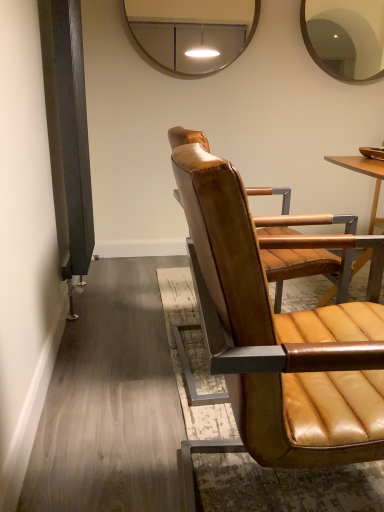
Question: Which direction should I rotate to look at metallic silver mirror at upper center, which is the 1th mirror from left to right, — up or down?

Choices:
 (A) down
 (B) up

Answer: (B)

Question: Does matte brown mirror at upper right, the second mirror viewed from the left, have a greater width compared to metallic silver mirror at upper center, which is the 1th mirror from left to right?

Choices:
 (A) no
 (B) yes

Answer: (B)

Question: Considering the relative sizes of matte brown mirror at upper right, marked as the first mirror in a right-to-left arrangement, and metallic silver mirror at upper center, which is the 1th mirror from left to right, in the image provided, is matte brown mirror at upper right, marked as the first mirror in a right-to-left arrangement, shorter than metallic silver mirror at upper center, which is the 1th mirror from left to right,?

Choices:
 (A) no
 (B) yes

Answer: (A)

Question: Is matte brown mirror at upper right, the second mirror viewed from the left, smaller than metallic silver mirror at upper center, arranged as the second mirror when viewed from the right?

Choices:
 (A) no
 (B) yes

Answer: (B)

Question: Is matte brown mirror at upper right, the second mirror viewed from the left, facing away from metallic silver mirror at upper center, which is the 1th mirror from left to right?

Choices:
 (A) yes
 (B) no

Answer: (B)

Question: From the image's perspective, does matte brown mirror at upper right, the second mirror viewed from the left, appear higher than metallic silver mirror at upper center, which is the 1th mirror from left to right?

Choices:
 (A) yes
 (B) no

Answer: (A)

Question: From a real-world perspective, is matte brown mirror at upper right, marked as the first mirror in a right-to-left arrangement, positioned over metallic silver mirror at upper center, arranged as the second mirror when viewed from the right, based on gravity?

Choices:
 (A) yes
 (B) no

Answer: (A)

Question: Is the depth of metallic silver mirror at upper center, which is the 1th mirror from left to right, greater than that of matte brown mirror at upper right, the second mirror viewed from the left?

Choices:
 (A) no
 (B) yes

Answer: (A)

Question: Is metallic silver mirror at upper center, arranged as the second mirror when viewed from the right, to the left of matte brown mirror at upper right, marked as the first mirror in a right-to-left arrangement, from the viewer's perspective?

Choices:
 (A) yes
 (B) no

Answer: (A)

Question: Is metallic silver mirror at upper center, which is the 1th mirror from left to right, positioned in front of matte brown mirror at upper right, marked as the first mirror in a right-to-left arrangement?

Choices:
 (A) no
 (B) yes

Answer: (B)

Question: Does metallic silver mirror at upper center, which is the 1th mirror from left to right, turn towards matte brown mirror at upper right, marked as the first mirror in a right-to-left arrangement?

Choices:
 (A) no
 (B) yes

Answer: (A)

Question: Is metallic silver mirror at upper center, which is the 1th mirror from left to right, positioned with its back to matte brown mirror at upper right, marked as the first mirror in a right-to-left arrangement?

Choices:
 (A) yes
 (B) no

Answer: (B)

Question: Considering the relative sizes of metallic silver mirror at upper center, arranged as the second mirror when viewed from the right, and matte brown mirror at upper right, marked as the first mirror in a right-to-left arrangement, in the image provided, is metallic silver mirror at upper center, arranged as the second mirror when viewed from the right, bigger than matte brown mirror at upper right, marked as the first mirror in a right-to-left arrangement,?

Choices:
 (A) no
 (B) yes

Answer: (B)

Question: Is matte brown leather chair at center not within matte brown mirror at upper right, marked as the first mirror in a right-to-left arrangement?

Choices:
 (A) yes
 (B) no

Answer: (A)